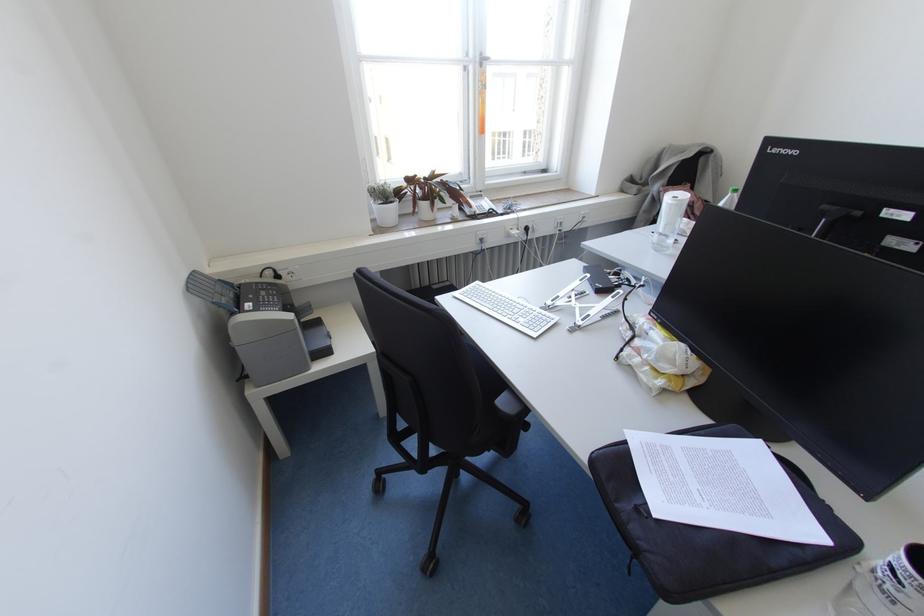
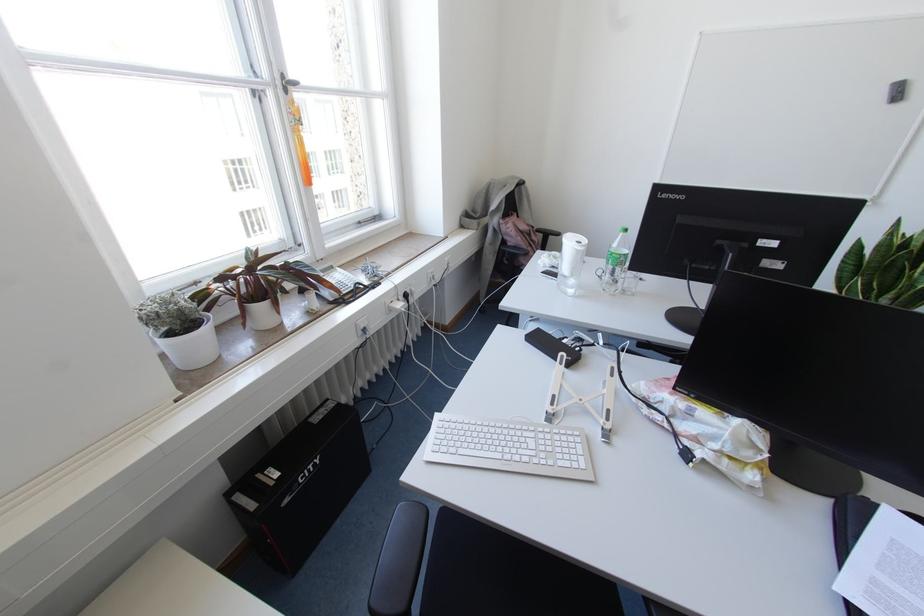
Locate, in the second image, the point that corresponds to (x=390, y=187) in the first image.

(186, 298)